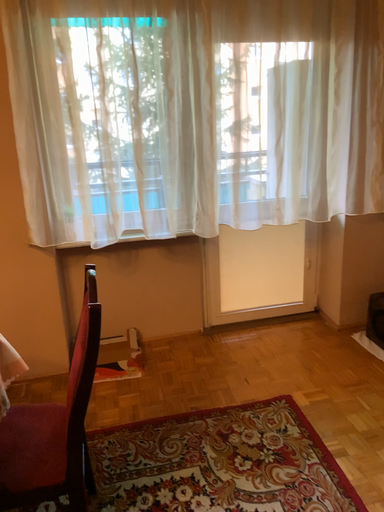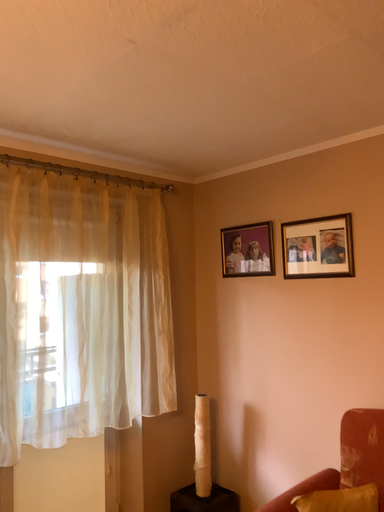
Question: Which way did the camera rotate in the video?

Choices:
 (A) rotated right
 (B) rotated left

Answer: (A)